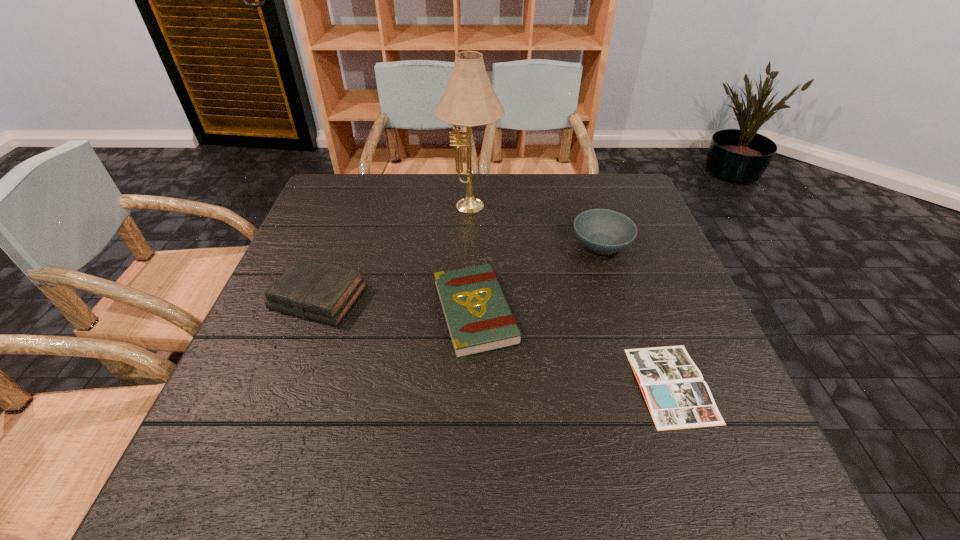
The height and width of the screenshot is (540, 960). I want to click on lampshade, so click(469, 100).

The height and width of the screenshot is (540, 960). Identify the location of the second tallest object. (602, 231).

Find the location of a particular element. the third shortest object is located at coordinates (320, 291).

At what (x,y) coordinates should I click in order to perform the action: click on the leftmost object. Please return your answer as a coordinate pair (x, y). This screenshot has width=960, height=540. Looking at the image, I should click on (320, 291).

The image size is (960, 540). What are the coordinates of `the second book from right to left` in the screenshot? It's located at (478, 317).

Find the location of `the second tallest book`. the second tallest book is located at coordinates (478, 317).

Identify the location of the shortest object. (677, 397).

What are the coordinates of `the shortest book` in the screenshot? It's located at (677, 397).

Find the location of a particular element. This screenshot has height=540, width=960. vacant region located on the front of the tallest object is located at coordinates (468, 327).

This screenshot has height=540, width=960. Find the location of `free space located on the back of the soup bowl`. free space located on the back of the soup bowl is located at coordinates (589, 208).